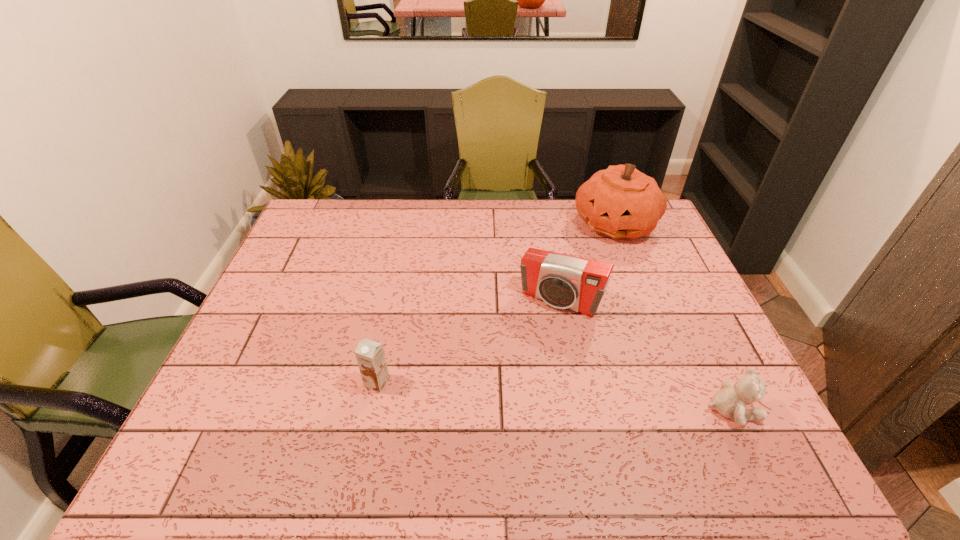
Where is `free space between the chocolate milk and the third nearest object`? The height and width of the screenshot is (540, 960). free space between the chocolate milk and the third nearest object is located at coordinates (468, 341).

This screenshot has height=540, width=960. What are the coordinates of `vacant space that is in between the teddy bear and the second farthest object` in the screenshot? It's located at (645, 355).

Where is `free space between the shortest object and the chocolate milk`? The width and height of the screenshot is (960, 540). free space between the shortest object and the chocolate milk is located at coordinates pyautogui.click(x=554, y=396).

Where is `object that is the third closest to the third nearest object`? The height and width of the screenshot is (540, 960). object that is the third closest to the third nearest object is located at coordinates (370, 356).

Choose which object is the second nearest neighbor to the farthest object. Please provide its 2D coordinates. Your answer should be formatted as a tuple, i.e. [(x, y)], where the tuple contains the x and y coordinates of a point satisfying the conditions above.

[(730, 402)]

This screenshot has height=540, width=960. In order to click on vacant space that satisfies the following two spatial constraints: 1. on the front side of the tallest object; 2. on the face of the shortest object in this screenshot , I will do `click(686, 410)`.

Image resolution: width=960 pixels, height=540 pixels. I want to click on free space that satisfies the following two spatial constraints: 1. on the back side of the second farthest object; 2. on the left side of the farthest object, so click(x=545, y=223).

Find the location of a particular element. free region that satisfies the following two spatial constraints: 1. on the front side of the shortest object; 2. on the face of the third nearest object is located at coordinates (581, 410).

Where is `vacant position in the image that satisfies the following two spatial constraints: 1. on the back side of the second farthest object; 2. on the right side of the chocolate milk`? vacant position in the image that satisfies the following two spatial constraints: 1. on the back side of the second farthest object; 2. on the right side of the chocolate milk is located at coordinates (395, 300).

Find the location of a particular element. This screenshot has height=540, width=960. vacant region that satisfies the following two spatial constraints: 1. on the front side of the pumpkin; 2. on the face of the teddy bear is located at coordinates (686, 410).